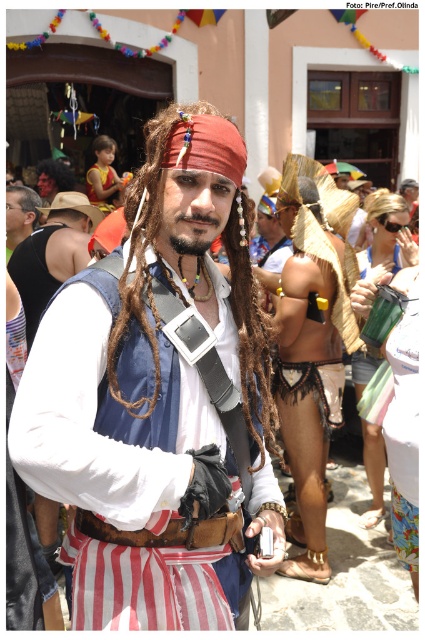
Who is more forward, (322, 294) or (28, 216)?

Point (322, 294) is in front.

Does brown woven fabric at center have a greater width compared to matte black vest at left?

Indeed, brown woven fabric at center has a greater width compared to matte black vest at left.

Locate an element on the screen. This screenshot has height=640, width=425. brown woven fabric at center is located at coordinates (311, 360).

Is matte yellow vest at upper left bigger than dark brown hair at center?

Correct, matte yellow vest at upper left is larger in size than dark brown hair at center.

Can you confirm if matte yellow vest at upper left is wider than dark brown hair at center?

Yes, matte yellow vest at upper left is wider than dark brown hair at center.

The width and height of the screenshot is (425, 640). What do you see at coordinates (101, 186) in the screenshot?
I see `matte yellow vest at upper left` at bounding box center [101, 186].

Locate an element on the screen. This screenshot has height=640, width=425. matte yellow vest at upper left is located at coordinates (101, 186).

Is the position of brown/dreadlocks at center more distant than that of matte black vest at left?

That is False.

Between brown/dreadlocks at center and matte black vest at left, which one appears on the left side from the viewer's perspective?

Positioned to the left is matte black vest at left.

Measure the distance between point (136, 410) and camera.

The distance of point (136, 410) from camera is 4.79 feet.

You are a GUI agent. You are given a task and a screenshot of the screen. Output one action in this format:
    pyautogui.click(x=<x>, y=<y>)
    Task: Click on the brown/dreadlocks at center
    
    Given the screenshot: What is the action you would take?
    pyautogui.click(x=146, y=243)